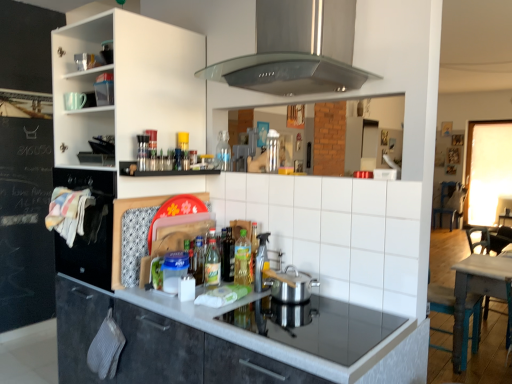
Question: From a real-world perspective, relative to white ceramic tile at center, is matte white cup at upper left, which is the 1th appliance in back-to-front order, vertically above or below?

Choices:
 (A) above
 (B) below

Answer: (A)

Question: Is point [x=69, y=109] positioned closer to the camera than point [x=274, y=185]?

Choices:
 (A) farther
 (B) closer

Answer: (A)

Question: Estimate the real-world distances between objects in this image. Which object is farther from the metallic silver shelf at upper center?

Choices:
 (A) green plastic bottle at center, which is counted as the 2th bottle, starting from the front
 (B) translucent plastic bottles at center, the 2th bottle when ordered from top to bottom
 (C) stainless steel range hood at upper center
 (D) wooden table at right
 (E) matte white cup at upper left, which is counted as the second appliance, starting from the bottom

Answer: (D)

Question: Which object is positioned farthest from the matte white cup at upper left, which appears as the second appliance when viewed from the front?

Choices:
 (A) green plastic bottle at center, positioned as the 2th bottle in bottom-to-top order
 (B) translucent plastic bottles at center, which is the third bottle from front to back
 (C) metallic silver shelf at upper center
 (D) translucent plastic spray bottle at center, which is counted as the second appliance, starting from the back
 (E) wooden chair at right, which ranks as the first chair in right-to-left order

Answer: (E)